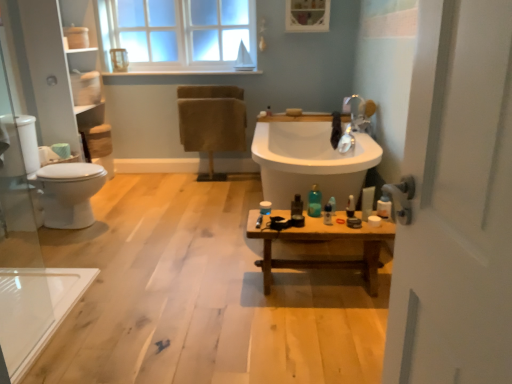
At what (x,y) coordinates should I click in order to perform the action: click on vacant space that is in between wooden bench at center and transparent glass door at left. Please return your answer as a coordinate pair (x, y). Looking at the image, I should click on (186, 315).